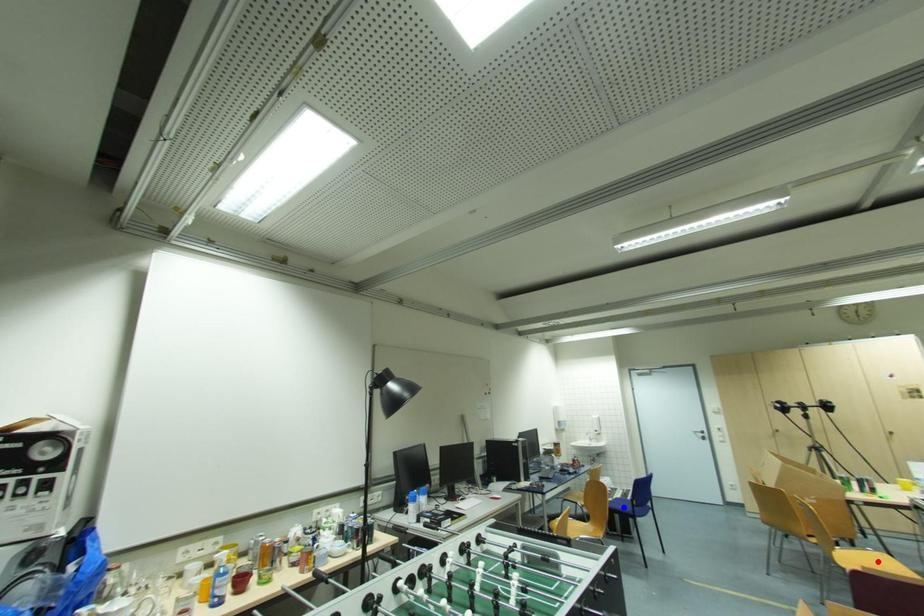
Question: Two points are marked on the image. Which point is closer to the camera?

Choices:
 (A) Blue point is closer.
 (B) Red point is closer.

Answer: (B)